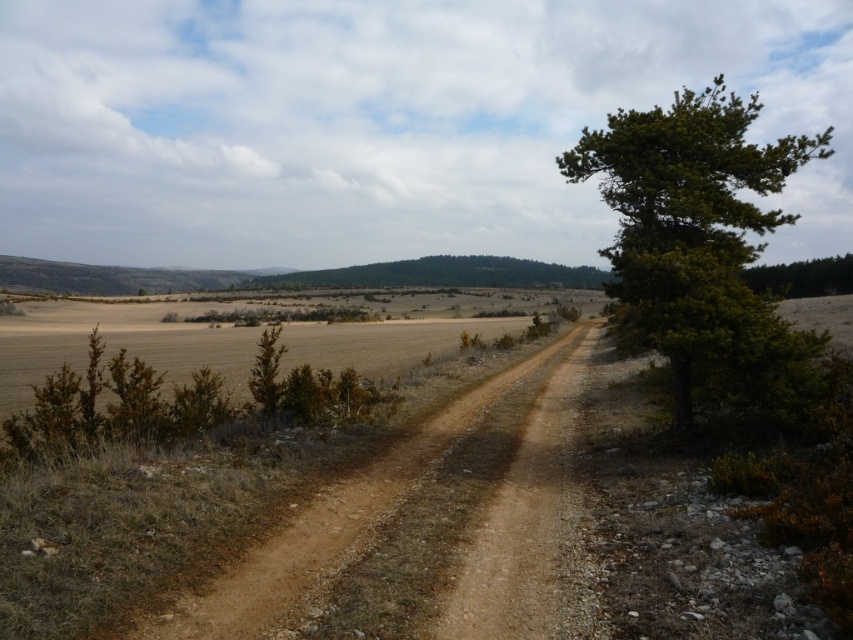
You are standing on the dirt path in the rural landscape and see two points marked in the image. Which point is closer to you, point (663, 317) or point (219, 611)?

Point (219, 611) is closer to you because it is less further to the viewer than point (663, 317).

You are standing at the point labeled as point (699, 244) in the image. Looking towards the green leafy tree at right, which direction should you walk to reach it?

Since the green leafy tree at right is located to the right side of the path, you should walk towards the right direction to reach it.